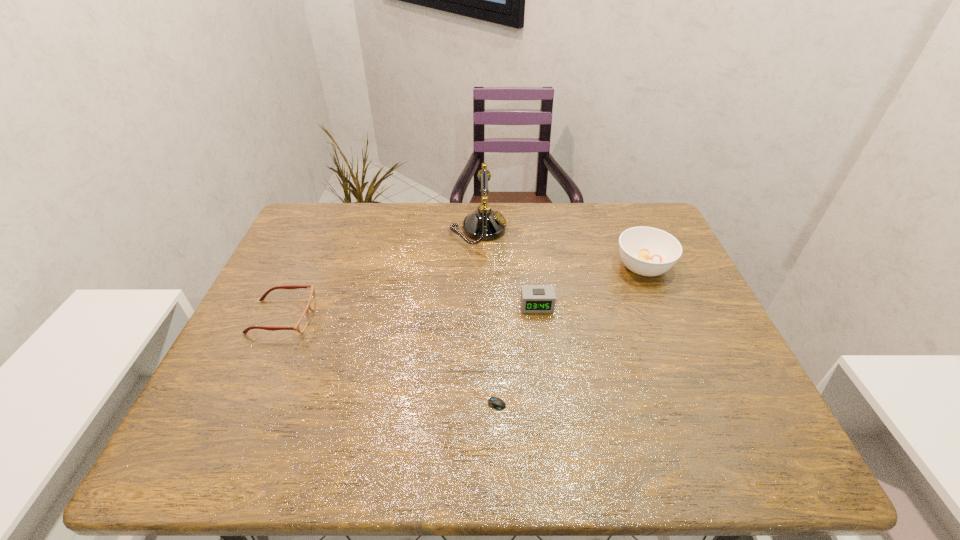
In order to click on vacant space at the far right corner of the desktop in this screenshot , I will do `click(646, 208)`.

The height and width of the screenshot is (540, 960). I want to click on vacant area between the spectacles and the rightmost object, so click(463, 292).

Where is `free point between the spectacles and the second tallest object`? Image resolution: width=960 pixels, height=540 pixels. free point between the spectacles and the second tallest object is located at coordinates (463, 292).

Locate an element on the screen. blank region between the telephone and the nearest object is located at coordinates (483, 314).

Locate an element on the screen. empty space that is in between the second tallest object and the tallest object is located at coordinates (561, 248).

Where is `vacant point located between the shortest object and the fourth shortest object`? The width and height of the screenshot is (960, 540). vacant point located between the shortest object and the fourth shortest object is located at coordinates (565, 333).

Find the location of a particular element. The image size is (960, 540). vacant point located between the telephone and the fourth object from left to right is located at coordinates [508, 268].

Where is `free spot between the spectacles and the mouse`? free spot between the spectacles and the mouse is located at coordinates (385, 358).

I want to click on vacant space that is in between the rightmost object and the mouse, so click(x=565, y=333).

You are a GUI agent. You are given a task and a screenshot of the screen. Output one action in this format:
    pyautogui.click(x=<x>, y=<y>)
    Task: Click on the vacant area that lies between the soup bowl and the nearest object
    This screenshot has width=960, height=540.
    Given the screenshot: What is the action you would take?
    pyautogui.click(x=565, y=333)